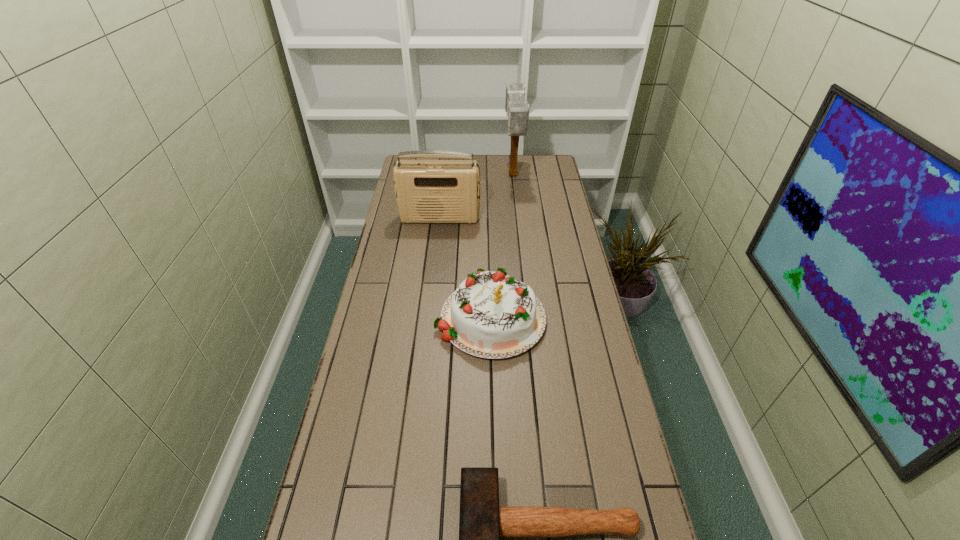
Image resolution: width=960 pixels, height=540 pixels. I want to click on object that is at the left edge, so click(x=427, y=191).

Image resolution: width=960 pixels, height=540 pixels. Find the location of `free location at the left edge of the desktop`. free location at the left edge of the desktop is located at coordinates (356, 415).

You are a GUI agent. You are given a task and a screenshot of the screen. Output one action in this format:
    pyautogui.click(x=<x>, y=<y>)
    Task: Click on the vacant space at the right edge
    The height and width of the screenshot is (540, 960).
    Given the screenshot: What is the action you would take?
    pyautogui.click(x=591, y=334)

Locate an element on the screen. vacant point at the far right corner is located at coordinates (536, 166).

This screenshot has width=960, height=540. I want to click on vacant area between the third tallest object and the farther mallet, so click(501, 245).

This screenshot has width=960, height=540. I want to click on unoccupied position between the cake and the radio receiver, so click(465, 266).

You are a GUI agent. You are given a task and a screenshot of the screen. Output one action in this format:
    pyautogui.click(x=<x>, y=<y>)
    Task: Click on the object that ranks as the third closest to the farthest object
    The image size is (960, 540).
    Given the screenshot: What is the action you would take?
    tap(482, 522)

Locate an element on the screen. the third closest object to the farthest object is located at coordinates (482, 522).

What are the coordinates of `free space that satisfies the following two spatial constraints: 1. on the front-facing side of the radio receiver; 2. on the right side of the second shortest object` in the screenshot? It's located at (429, 315).

Locate an element on the screen. free space that satisfies the following two spatial constraints: 1. on the back side of the farther mallet; 2. on the left side of the third farthest object is located at coordinates (487, 176).